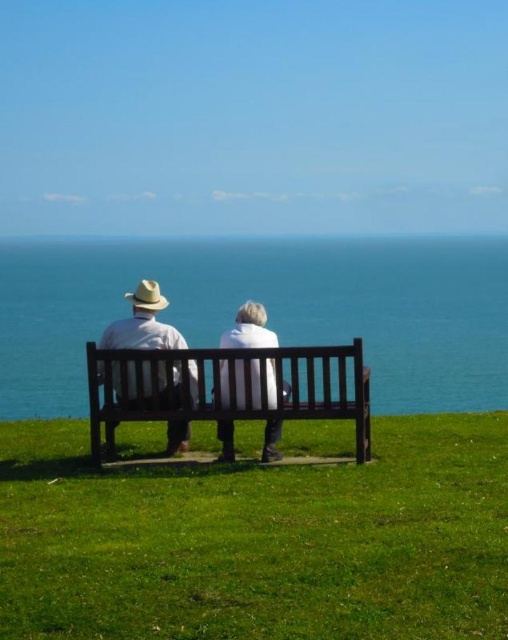
Is wooden bench at center thinner than white matte jacket at center?

No, wooden bench at center is not thinner than white matte jacket at center.

Which is more to the right, wooden bench at center or white matte jacket at center?

Positioned to the right is white matte jacket at center.

Which is in front, point (285, 356) or point (230, 420)?

Point (285, 356) is more forward.

Locate an element on the screen. wooden bench at center is located at coordinates (227, 387).

Describe the element at coordinates (267, 308) in the screenshot. Image resolution: width=508 pixels, height=640 pixels. I see `blue water at center` at that location.

Which of these two, blue water at center or white matte jacket at center, stands shorter?

white matte jacket at center

Does point (265, 280) lie behind point (275, 452)?

That is True.

I want to click on blue water at center, so click(x=267, y=308).

Looking at this image, does green grass at center appear on the right side of wooden bench at center?

Incorrect, green grass at center is not on the right side of wooden bench at center.

Which is below, green grass at center or wooden bench at center?

Positioned lower is green grass at center.

Locate an element on the screen. This screenshot has height=640, width=508. green grass at center is located at coordinates (259, 540).